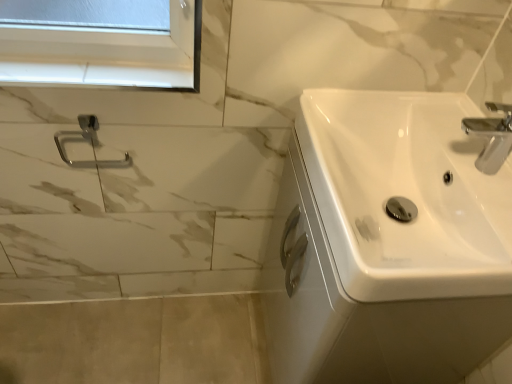
The width and height of the screenshot is (512, 384). I want to click on free spot above white glossy window sill at upper left (from a real-world perspective), so click(94, 66).